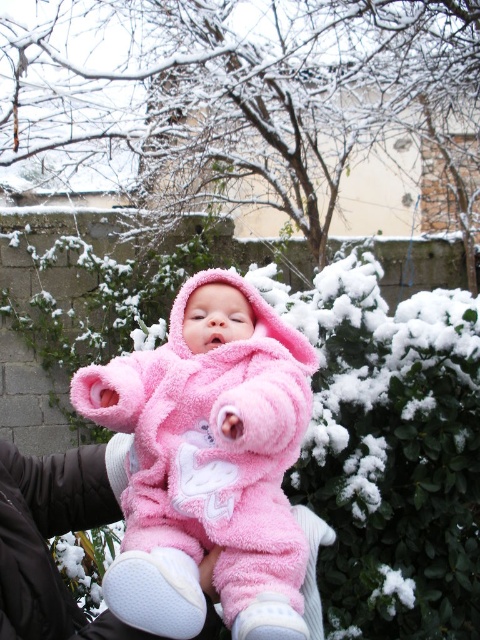
Who is shorter, white fluffy hedge at center or pink fluffy onesie at center?

pink fluffy onesie at center

Between white fluffy hedge at center and pink fluffy onesie at center, which one is positioned higher?

pink fluffy onesie at center is above.

Is point (436, 252) positioned in front of point (156, 621)?

No, it is not.

Where is `white fluffy hedge at center`? The image size is (480, 640). white fluffy hedge at center is located at coordinates (382, 428).